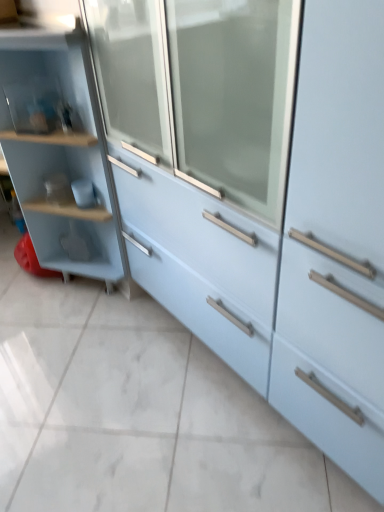
Find the location of a particular element. This screenshot has height=512, width=384. vacant area that is in front of matte white shelf at left is located at coordinates (67, 352).